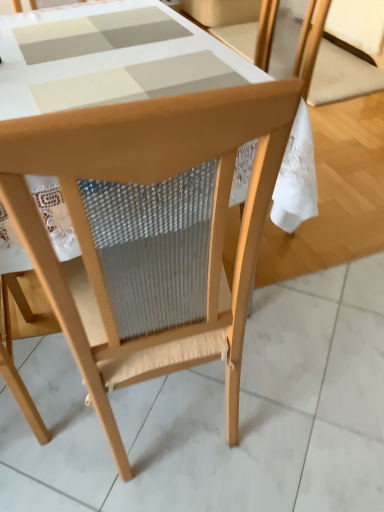
The width and height of the screenshot is (384, 512). What are the coordinates of `wooden chair at upper right, placed as the 1th chair when sorted from top to bottom` in the screenshot? It's located at (347, 54).

Measure the distance between point (283, 76) and camera.

They are 4.48 feet apart.

This screenshot has height=512, width=384. Describe the element at coordinates (347, 54) in the screenshot. I see `wooden chair at upper right, acting as the second chair starting from the bottom` at that location.

What do you see at coordinates (149, 230) in the screenshot? The image size is (384, 512). I see `natural wood chair at center, the first chair positioned from the left` at bounding box center [149, 230].

You are a GUI agent. You are given a task and a screenshot of the screen. Output one action in this format:
    pyautogui.click(x=<x>, y=<y>)
    Task: Click on the natural wood chair at center, marked as the 2th chair in a top-to-bottom arrangement
    Image resolution: width=384 pixels, height=512 pixels.
    Given the screenshot: What is the action you would take?
    pyautogui.click(x=149, y=230)

What is the approximate width of natural wood chair at center, the second chair from the back?

19.41 inches.

Measure the distance between natural wood chair at center, the 1th chair in the front-to-back sequence, and camera.

natural wood chair at center, the 1th chair in the front-to-back sequence, and camera are 39.14 centimeters apart from each other.

The width and height of the screenshot is (384, 512). Identify the location of wooden chair at upper right, which ranks as the second chair in left-to-right order. (347, 54).

Would you say natural wood chair at center, the 1th chair in the front-to-back sequence, is to the left or to the right of wooden chair at upper right, positioned as the first chair in right-to-left order, in the picture?

Clearly, natural wood chair at center, the 1th chair in the front-to-back sequence, is on the left of wooden chair at upper right, positioned as the first chair in right-to-left order, in the image.

Does natural wood chair at center, placed as the 2th chair when sorted from right to left, lie behind wooden chair at upper right, placed as the 1th chair when sorted from back to front?

That is False.

Which is in front, point (124, 126) or point (370, 84)?

The point (124, 126) is more forward.

From the image's perspective, is natural wood chair at center, the 1th chair in the front-to-back sequence, located above or below wooden chair at upper right, placed as the 1th chair when sorted from top to bottom?

Based on their image positions, natural wood chair at center, the 1th chair in the front-to-back sequence, is located beneath wooden chair at upper right, placed as the 1th chair when sorted from top to bottom.

From a real-world perspective, which is physically above, natural wood chair at center, the second chair from the back, or wooden chair at upper right, positioned as the first chair in right-to-left order?

In real-world perspective, natural wood chair at center, the second chair from the back, is above.

Considering the sizes of natural wood chair at center, the first chair positioned from the left, and wooden chair at upper right, which ranks as the second chair in left-to-right order, in the image, is natural wood chair at center, the first chair positioned from the left, wider or thinner than wooden chair at upper right, which ranks as the second chair in left-to-right order,?

In the image, natural wood chair at center, the first chair positioned from the left, appears to be more narrow than wooden chair at upper right, which ranks as the second chair in left-to-right order.

Can you confirm if natural wood chair at center, the second chair from the back, is shorter than wooden chair at upper right, placed as the 1th chair when sorted from top to bottom?

No.

Based on their sizes in the image, would you say natural wood chair at center, placed as the 2th chair when sorted from right to left, is bigger or smaller than wooden chair at upper right, positioned as the first chair in right-to-left order?

Considering their sizes, natural wood chair at center, placed as the 2th chair when sorted from right to left, takes up more space than wooden chair at upper right, positioned as the first chair in right-to-left order.

Is wooden chair at upper right, which ranks as the second chair in left-to-right order, inside natural wood chair at center, the 1th chair in the front-to-back sequence?

No, wooden chair at upper right, which ranks as the second chair in left-to-right order, is not surrounded by natural wood chair at center, the 1th chair in the front-to-back sequence.

Is natural wood chair at center, the 1th chair in the front-to-back sequence, not near wooden chair at upper right, positioned as the first chair in right-to-left order?

That's right, there is a large distance between natural wood chair at center, the 1th chair in the front-to-back sequence, and wooden chair at upper right, positioned as the first chair in right-to-left order.

Is natural wood chair at center, which appears as the 1th chair when ordered from the bottom, facing towards wooden chair at upper right, placed as the 1th chair when sorted from back to front?

No.

Can you tell me how much natural wood chair at center, the second chair from the back, and wooden chair at upper right, which ranks as the second chair in left-to-right order, differ in facing direction?

The angular difference between natural wood chair at center, the second chair from the back, and wooden chair at upper right, which ranks as the second chair in left-to-right order, is 96.9 degrees.

Could you measure the distance between natural wood chair at center, placed as the 2th chair when sorted from right to left, and wooden chair at upper right, positioned as the first chair in right-to-left order?

natural wood chair at center, placed as the 2th chair when sorted from right to left, and wooden chair at upper right, positioned as the first chair in right-to-left order, are 7.28 feet apart.

This screenshot has height=512, width=384. I want to click on chair behind the natural wood chair at center, marked as the 2th chair in a top-to-bottom arrangement, so click(347, 54).

Which is more to the left, wooden chair at upper right, which ranks as the second chair in left-to-right order, or natural wood chair at center, the first chair positioned from the left?

natural wood chair at center, the first chair positioned from the left, is more to the left.

Is wooden chair at upper right, placed as the 1th chair when sorted from back to front, positioned before natural wood chair at center, the first chair positioned from the left?

No, it is not.

Which is in front, point (350, 9) or point (13, 168)?

The point (13, 168) is more forward.

Consider the image. From the image's perspective, is wooden chair at upper right, which is counted as the second chair, starting from the front, under natural wood chair at center, the first chair positioned from the left?

Actually, wooden chair at upper right, which is counted as the second chair, starting from the front, appears above natural wood chair at center, the first chair positioned from the left, in the image.

From a real-world perspective, does wooden chair at upper right, which ranks as the second chair in left-to-right order, sit lower than natural wood chair at center, the first chair positioned from the left?

Yes, from a real-world perspective, wooden chair at upper right, which ranks as the second chair in left-to-right order, is below natural wood chair at center, the first chair positioned from the left.

In terms of width, does wooden chair at upper right, positioned as the first chair in right-to-left order, look wider or thinner when compared to natural wood chair at center, marked as the 2th chair in a top-to-bottom arrangement?

In the image, wooden chair at upper right, positioned as the first chair in right-to-left order, appears to be wider than natural wood chair at center, marked as the 2th chair in a top-to-bottom arrangement.

Considering the sizes of objects wooden chair at upper right, which ranks as the second chair in left-to-right order, and natural wood chair at center, the 1th chair in the front-to-back sequence, in the image provided, who is taller, wooden chair at upper right, which ranks as the second chair in left-to-right order, or natural wood chair at center, the 1th chair in the front-to-back sequence,?

natural wood chair at center, the 1th chair in the front-to-back sequence, is taller.

Who is bigger, wooden chair at upper right, which is counted as the second chair, starting from the front, or natural wood chair at center, the second chair from the back?

natural wood chair at center, the second chair from the back, is bigger.

Is wooden chair at upper right, placed as the 1th chair when sorted from top to bottom, situated inside natural wood chair at center, the second chair from the back, or outside?

wooden chair at upper right, placed as the 1th chair when sorted from top to bottom, exists outside the volume of natural wood chair at center, the second chair from the back.

Is wooden chair at upper right, positioned as the first chair in right-to-left order, not near natural wood chair at center, which appears as the 1th chair when ordered from the bottom?

Yes, wooden chair at upper right, positioned as the first chair in right-to-left order, is far from natural wood chair at center, which appears as the 1th chair when ordered from the bottom.

Is wooden chair at upper right, positioned as the first chair in right-to-left order, looking in the opposite direction of natural wood chair at center, placed as the 2th chair when sorted from right to left?

No, wooden chair at upper right, positioned as the first chair in right-to-left order, is not facing away from natural wood chair at center, placed as the 2th chair when sorted from right to left.

Locate an element on the screen. chair that is below the wooden chair at upper right, which ranks as the second chair in left-to-right order (from the image's perspective) is located at coordinates [x=149, y=230].

The height and width of the screenshot is (512, 384). Find the location of `chair in front of the wooden chair at upper right, placed as the 1th chair when sorted from top to bottom`. chair in front of the wooden chair at upper right, placed as the 1th chair when sorted from top to bottom is located at coordinates (149, 230).

You are a GUI agent. You are given a task and a screenshot of the screen. Output one action in this format:
    pyautogui.click(x=<x>, y=<y>)
    Task: Click on the chair below the wooden chair at upper right, acting as the second chair starting from the bottom (from the image's perspective)
    
    Given the screenshot: What is the action you would take?
    pyautogui.click(x=149, y=230)